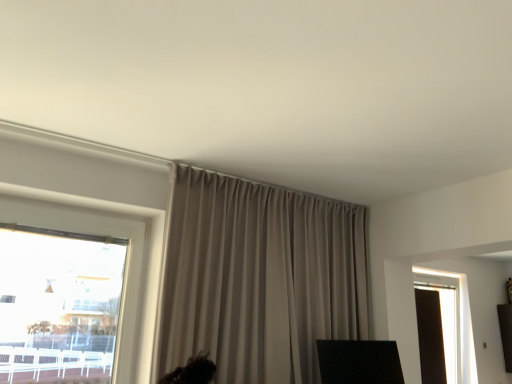
In order to face beige fabric curtain at center, should I rotate leftwards or rightwards?

A 3.252 degree turn to the right will do.

What is the approximate height of beige fabric curtain at center?

beige fabric curtain at center is 3.65 feet in height.

The image size is (512, 384). Find the location of `beige fabric curtain at center`. beige fabric curtain at center is located at coordinates (259, 278).

Measure the distance between beige fabric curtain at center and camera.

beige fabric curtain at center and camera are 6.29 feet apart.

The width and height of the screenshot is (512, 384). What do you see at coordinates (259, 278) in the screenshot?
I see `beige fabric curtain at center` at bounding box center [259, 278].

What is the approximate height of matte glass window at right?

1.12 meters.

What are the coordinates of `matte glass window at right` in the screenshot? It's located at (454, 325).

Based on the photo, measure the distance between point (462, 273) and camera.

The distance of point (462, 273) from camera is 14.87 feet.

What do you see at coordinates (454, 325) in the screenshot?
I see `matte glass window at right` at bounding box center [454, 325].

The width and height of the screenshot is (512, 384). Find the location of `beige fabric curtain at center`. beige fabric curtain at center is located at coordinates (259, 278).

Looking at this image, does beige fabric curtain at center appear on the right side of matte glass window at right?

No, beige fabric curtain at center is not to the right of matte glass window at right.

Relative to matte glass window at right, is beige fabric curtain at center in front or behind?

Visually, beige fabric curtain at center is located in front of matte glass window at right.

Does point (174, 182) lie in front of point (413, 272)?

Yes, it is in front of point (413, 272).

From the image's perspective, which is above, beige fabric curtain at center or matte glass window at right?

beige fabric curtain at center is shown above in the image.

From a real-world perspective, is beige fabric curtain at center located beneath matte glass window at right?

Actually, beige fabric curtain at center is physically above matte glass window at right in the real world.

In terms of width, does beige fabric curtain at center look wider or thinner when compared to matte glass window at right?

Clearly, beige fabric curtain at center has less width compared to matte glass window at right.

Looking at this image, does beige fabric curtain at center have a greater height compared to matte glass window at right?

Incorrect, the height of beige fabric curtain at center is not larger of that of matte glass window at right.

Which of these two, beige fabric curtain at center or matte glass window at right, is smaller?

Smaller between the two is matte glass window at right.

Is beige fabric curtain at center located outside matte glass window at right?

Yes, beige fabric curtain at center is located beyond the bounds of matte glass window at right.

Is the surface of beige fabric curtain at center in direct contact with matte glass window at right?

No, beige fabric curtain at center is not making contact with matte glass window at right.

Is beige fabric curtain at center positioned with its back to matte glass window at right?

No, beige fabric curtain at center is not facing the opposite direction of matte glass window at right.

Can you tell me how much beige fabric curtain at center and matte glass window at right differ in facing direction?

beige fabric curtain at center and matte glass window at right are facing 0.000139 degrees away from each other.

Where is `window on the right of beige fabric curtain at center`? This screenshot has width=512, height=384. window on the right of beige fabric curtain at center is located at coordinates (454, 325).

Considering the relative positions of matte glass window at right and beige fabric curtain at center in the image provided, is matte glass window at right to the right of beige fabric curtain at center from the viewer's perspective?

Yes, matte glass window at right is to the right of beige fabric curtain at center.

Between matte glass window at right and beige fabric curtain at center, which one is positioned in front?

beige fabric curtain at center is more forward.

Which is behind, point (466, 338) or point (204, 326)?

Positioned behind is point (466, 338).

From the image's perspective, is matte glass window at right on top of beige fabric curtain at center?

No, from the image's perspective, matte glass window at right is not over beige fabric curtain at center.

From a real-world perspective, which object rests below the other?

In real-world perspective, matte glass window at right is lower.

Considering the relative sizes of matte glass window at right and beige fabric curtain at center in the image provided, is matte glass window at right wider than beige fabric curtain at center?

Indeed, matte glass window at right has a greater width compared to beige fabric curtain at center.

Which of these two, matte glass window at right or beige fabric curtain at center, stands taller?

Standing taller between the two is matte glass window at right.

Based on their sizes in the image, would you say matte glass window at right is bigger or smaller than beige fabric curtain at center?

matte glass window at right is smaller than beige fabric curtain at center.

Is matte glass window at right outside of beige fabric curtain at center?

Indeed, matte glass window at right is completely outside beige fabric curtain at center.

Is matte glass window at right positioned far away from beige fabric curtain at center?

Yes.

Does matte glass window at right turn towards beige fabric curtain at center?

No, matte glass window at right is not oriented towards beige fabric curtain at center.

How much distance is there between matte glass window at right and beige fabric curtain at center?

matte glass window at right and beige fabric curtain at center are 2.13 meters apart.

Find the location of `curtain in front of the matte glass window at right`. curtain in front of the matte glass window at right is located at coordinates (259, 278).

Locate an element on the screen. Image resolution: width=512 pixels, height=384 pixels. curtain above the matte glass window at right (from a real-world perspective) is located at coordinates (259, 278).

Where is `window lying behind the beige fabric curtain at center`? The height and width of the screenshot is (384, 512). window lying behind the beige fabric curtain at center is located at coordinates (x=454, y=325).